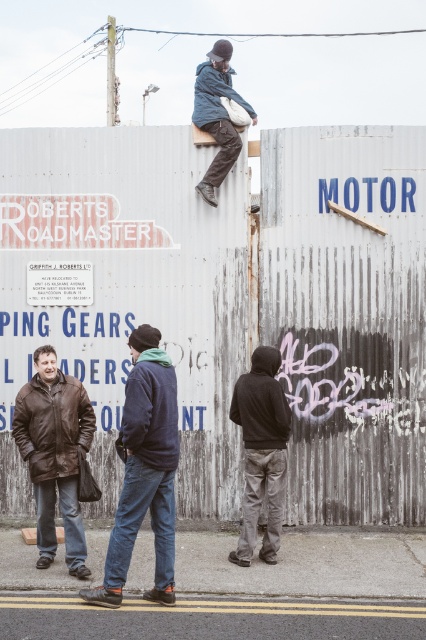
Between dark gray hoodie at center and denim jacket at upper center, which one is positioned lower?

Positioned lower is dark gray hoodie at center.

Is point (270, 381) closer to camera compared to point (226, 136)?

That is True.

Image resolution: width=426 pixels, height=640 pixels. Find the location of `dark gray hoodie at center`. dark gray hoodie at center is located at coordinates (261, 451).

Who is positioned more to the left, dark blue jacket at center or dark gray hoodie at center?

dark blue jacket at center is more to the left.

Between dark blue jacket at center and dark gray hoodie at center, which one is positioned lower?

Positioned lower is dark blue jacket at center.

Identify the location of dark blue jacket at center. Image resolution: width=426 pixels, height=640 pixels. (x=144, y=472).

How far apart are dark blue jacket at center and brown leather jacket at lower left?

dark blue jacket at center and brown leather jacket at lower left are 33.74 inches apart.

Is dark blue jacket at center bigger than brown leather jacket at lower left?

Indeed, dark blue jacket at center has a larger size compared to brown leather jacket at lower left.

Identify the location of dark blue jacket at center. (144, 472).